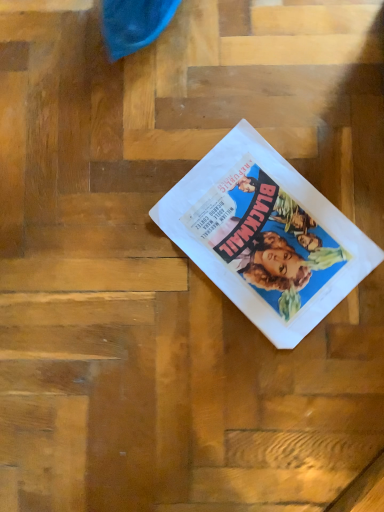
Where is `free point above white paper at center (from a real-world perspective)`? This screenshot has height=512, width=384. free point above white paper at center (from a real-world perspective) is located at coordinates (269, 220).